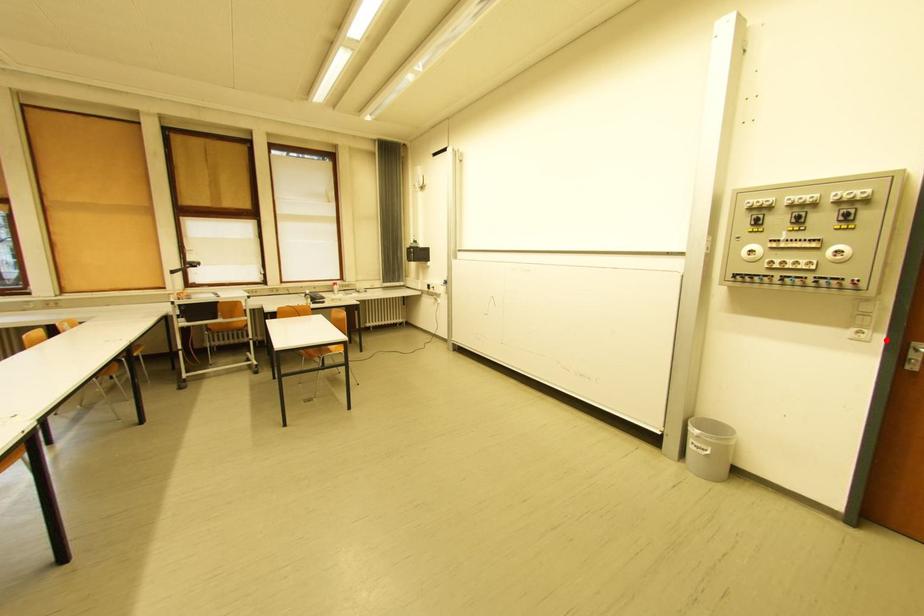
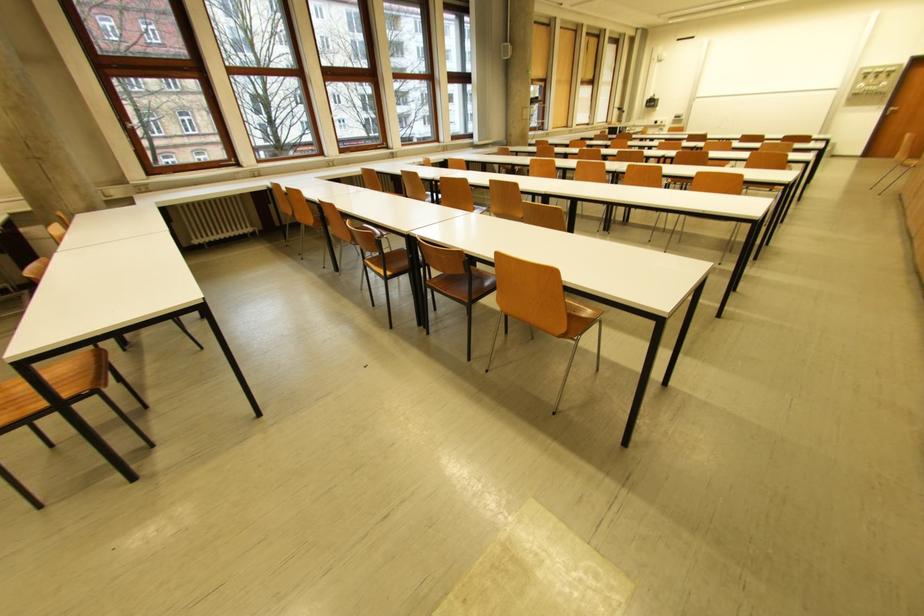
Locate, in the second image, the point that corresponds to the highlighted location in the first image.

(891, 108)